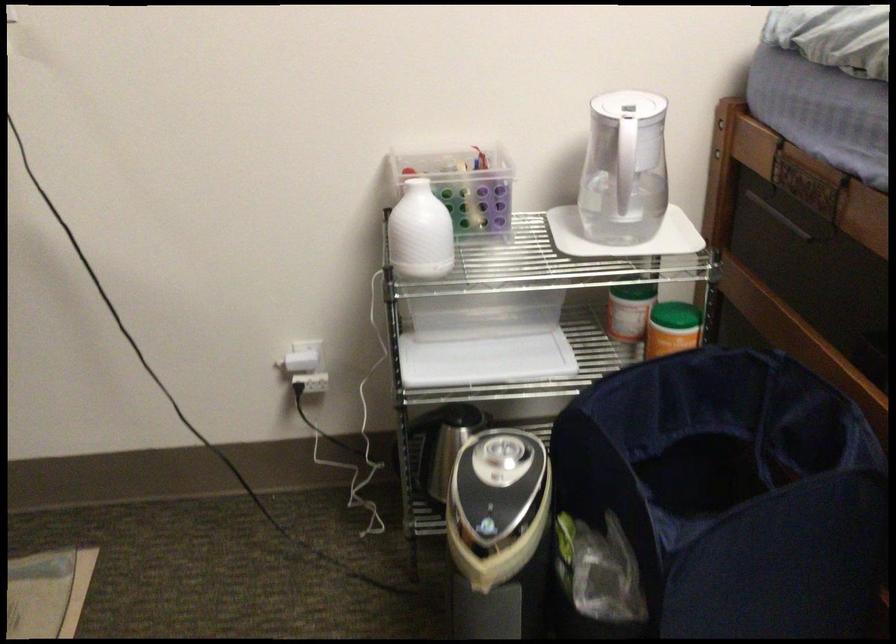
What do you see at coordinates (624, 236) in the screenshot? This screenshot has width=896, height=644. I see `the white jar lid` at bounding box center [624, 236].